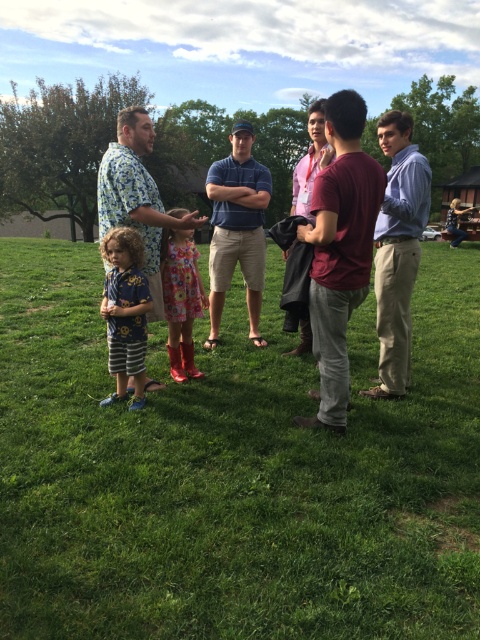
You are taking a photo of the group in the park. You want to focus on the point that is closer to the camera. Which point should you choose between point (425, 221) and point (119, 244)?

Point (119, 244) is closer to the camera than point (425, 221), so you should focus on point (119, 244).

You are a photographer trying to capture a group photo of the light blue shirt at right and the blue printed shirt at lower left. Which of the two should you focus on first if you want to ensure both are in the frame without cropping?

The light blue shirt at right is bigger than the blue printed shirt at lower left, so you should focus on the light blue shirt at right first to ensure it fits within the frame before adjusting for the smaller one.